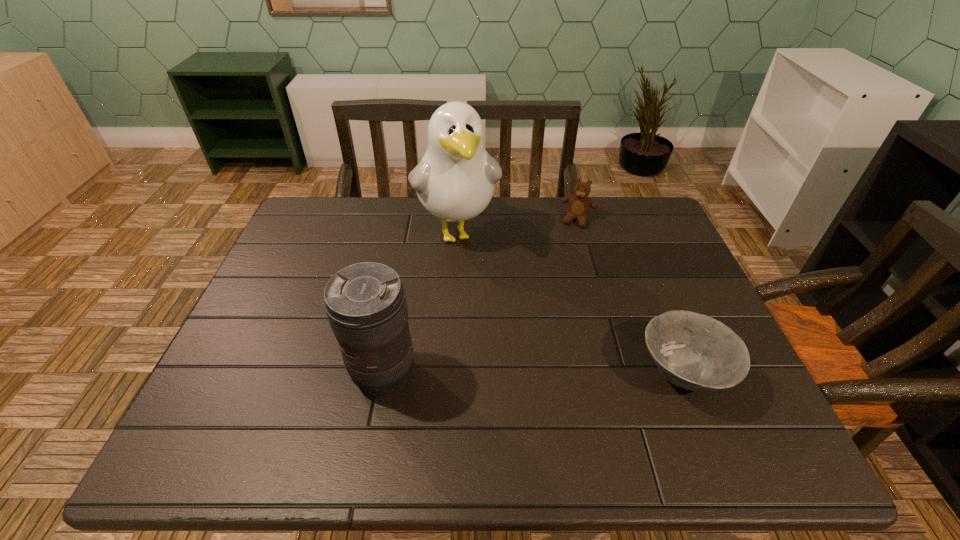
You are a GUI agent. You are given a task and a screenshot of the screen. Output one action in this format:
    pyautogui.click(x=<x>, y=<y>)
    Task: Click on the vacant space that is in between the tallest object and the bowl
    This screenshot has height=540, width=960.
    Given the screenshot: What is the action you would take?
    click(x=569, y=303)

You are a GUI agent. You are given a task and a screenshot of the screen. Output one action in this format:
    pyautogui.click(x=<x>, y=<y>)
    Task: Click on the vacant space in between the gull and the second tallest object
    
    Given the screenshot: What is the action you would take?
    pyautogui.click(x=420, y=303)

I want to click on unoccupied area between the second tallest object and the gull, so click(420, 303).

Identify which object is the third closest to the second shortest object. Please provide its 2D coordinates. Your answer should be formatted as a tuple, i.e. [(x, y)], where the tuple contains the x and y coordinates of a point satisfying the conditions above.

[(365, 303)]

Find the location of a particular element. The height and width of the screenshot is (540, 960). object identified as the closest to the third tallest object is located at coordinates (455, 180).

The height and width of the screenshot is (540, 960). In order to click on free point that satisfies the following two spatial constraints: 1. on the front side of the tallest object; 2. on the left side of the shortest object in this screenshot , I will do `click(449, 374)`.